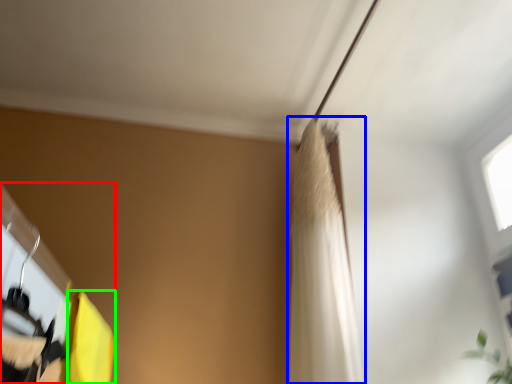
Question: Considering the real-world distances, which object is farthest from closet (highlighted by a red box)? shower curtain (highlighted by a blue box) or curtain (highlighted by a green box)?

Choices:
 (A) shower curtain
 (B) curtain

Answer: (A)